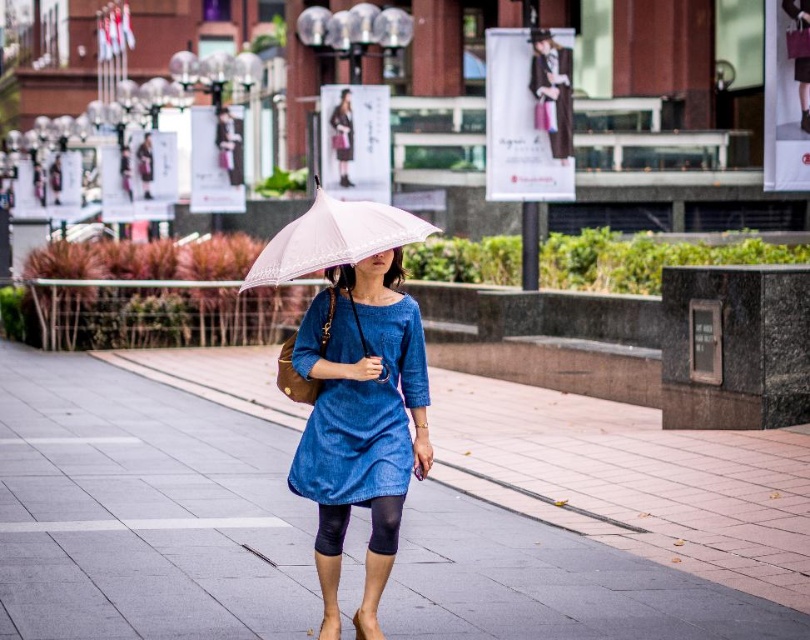
Question: Among these points, which one is nearest to the camera?

Choices:
 (A) (258, 269)
 (B) (348, 340)
 (C) (58, 531)
 (D) (393, 496)

Answer: (D)

Question: Does smooth concrete pavement at center have a larger size compared to black matte leggings at center?

Choices:
 (A) no
 (B) yes

Answer: (B)

Question: Which object is farther from the camera taking this photo?

Choices:
 (A) black matte leggings at center
 (B) smooth concrete pavement at center

Answer: (B)

Question: Is smooth concrete pavement at center to the right of white lace umbrella at center from the viewer's perspective?

Choices:
 (A) yes
 (B) no

Answer: (B)

Question: Does smooth concrete pavement at center come in front of denim dress at center?

Choices:
 (A) yes
 (B) no

Answer: (B)

Question: Among these points, which one is nearest to the camera?

Choices:
 (A) (416, 394)
 (B) (305, 545)
 (C) (337, 554)
 (D) (286, 234)

Answer: (D)